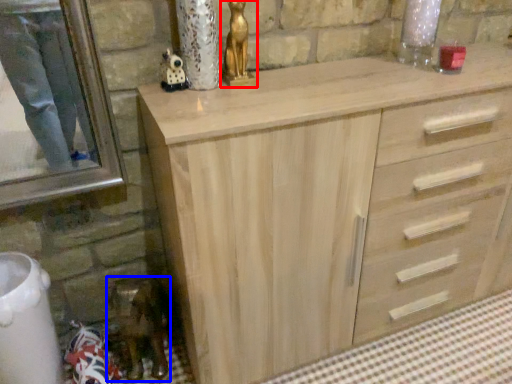
Question: Which object is further to the camera taking this photo, sculpture (highlighted by a red box) or miniature (highlighted by a blue box)?

Choices:
 (A) sculpture
 (B) miniature

Answer: (B)